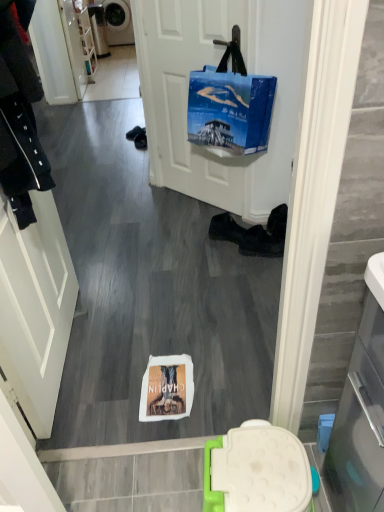
This screenshot has width=384, height=512. I want to click on free point behind white glossy door at left, so click(107, 278).